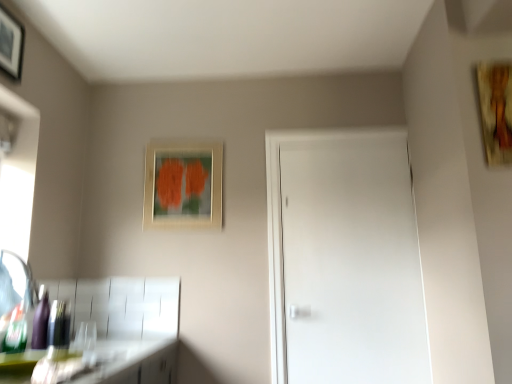
Locate an element on the screen. wooden textured painting at upper right, marked as the 3th picture frame in a back-to-front arrangement is located at coordinates (496, 111).

In order to click on matte wooden picture frame at upper center, which appears as the second picture frame when viewed from the right in this screenshot , I will do tap(183, 185).

Measure the distance between shiny purple bottle at lower left and camera.

The depth of shiny purple bottle at lower left is 1.80 meters.

This screenshot has height=384, width=512. In order to click on white matte door at center in this screenshot , I will do `click(344, 259)`.

Considering the relative sizes of wooden textured painting at upper right, marked as the 3th picture frame in a back-to-front arrangement, and green matte countertop at lower left in the image provided, is wooden textured painting at upper right, marked as the 3th picture frame in a back-to-front arrangement, wider than green matte countertop at lower left?

No.

Is wooden textured painting at upper right, which appears as the third picture frame when viewed from the left, further to camera compared to green matte countertop at lower left?

Yes, wooden textured painting at upper right, which appears as the third picture frame when viewed from the left, is further from the viewer.

From the green matte countertop at lower left, count 1st picture frames backward and point to it. Please provide its 2D coordinates.

[(496, 111)]

Is there a large distance between wooden textured painting at upper right, arranged as the first picture frame when viewed from the right, and green matte countertop at lower left?

Absolutely, wooden textured painting at upper right, arranged as the first picture frame when viewed from the right, is distant from green matte countertop at lower left.

Can you confirm if white matte door at center is thinner than wooden textured painting at upper right, which appears as the third picture frame when viewed from the left?

In fact, white matte door at center might be wider than wooden textured painting at upper right, which appears as the third picture frame when viewed from the left.

Between white matte door at center and wooden textured painting at upper right, which appears as the third picture frame when viewed from the left, which one has more height?

white matte door at center is taller.

Which is more to the right, white matte door at center or wooden textured painting at upper right, marked as the 3th picture frame in a back-to-front arrangement?

From the viewer's perspective, wooden textured painting at upper right, marked as the 3th picture frame in a back-to-front arrangement, appears more on the right side.

Is green matte countertop at lower left taller or shorter than white matte door at center?

In the image, green matte countertop at lower left appears to be shorter than white matte door at center.

From a real-world perspective, which object rests below the other?

From a 3D spatial view, green matte countertop at lower left is below.

Looking at this image, from the image's perspective, between green matte countertop at lower left and white matte door at center, which one is located above?

white matte door at center is shown above in the image.

Would you say green matte countertop at lower left is outside white matte door at center?

Absolutely, green matte countertop at lower left is external to white matte door at center.

The image size is (512, 384). Find the location of `the 1st picture frame in front of the shiny purple bottle at lower left, starting your count from the anchor`. the 1st picture frame in front of the shiny purple bottle at lower left, starting your count from the anchor is located at coordinates pyautogui.click(x=11, y=44).

Considering the positions of objects shiny purple bottle at lower left and wooden picture frame at upper left, the 3th picture frame positioned from the right, in the image provided, who is in front, shiny purple bottle at lower left or wooden picture frame at upper left, the 3th picture frame positioned from the right,?

wooden picture frame at upper left, the 3th picture frame positioned from the right.

Would you say shiny purple bottle at lower left is outside wooden picture frame at upper left, placed as the first picture frame when sorted from left to right?

That's correct, shiny purple bottle at lower left is outside of wooden picture frame at upper left, placed as the first picture frame when sorted from left to right.

From the image's perspective, which is below, shiny purple bottle at lower left or wooden picture frame at upper left, the 2th picture frame from the front?

From the image's view, shiny purple bottle at lower left is below.

Considering the sizes of objects wooden picture frame at upper left, the 2th picture frame from the front, and shiny purple bottle at lower left in the image provided, who is shorter, wooden picture frame at upper left, the 2th picture frame from the front, or shiny purple bottle at lower left?

shiny purple bottle at lower left is shorter.

Is there a large distance between wooden picture frame at upper left, the 3th picture frame positioned from the right, and shiny purple bottle at lower left?

Indeed, wooden picture frame at upper left, the 3th picture frame positioned from the right, is not near shiny purple bottle at lower left.

Can you confirm if wooden picture frame at upper left, which appears as the second picture frame when viewed from the back, is smaller than shiny purple bottle at lower left?

Actually, wooden picture frame at upper left, which appears as the second picture frame when viewed from the back, might be larger than shiny purple bottle at lower left.

Considering the points (21, 52) and (48, 297), which point is in front, point (21, 52) or point (48, 297)?

Positioned in front is point (21, 52).

From a real-world perspective, is green matte countertop at lower left above or below brushed metal faucet at lower left?

green matte countertop at lower left is situated lower than brushed metal faucet at lower left in the real world.

Based on their positions, is green matte countertop at lower left located to the left or right of brushed metal faucet at lower left?

From the image, it's evident that green matte countertop at lower left is to the right of brushed metal faucet at lower left.

Which is closer to the camera, [167,345] or [15,254]?

The point [15,254] is closer to the camera.

Is green matte countertop at lower left facing towards brushed metal faucet at lower left?

No, green matte countertop at lower left is not aimed at brushed metal faucet at lower left.

The image size is (512, 384). I want to click on the 1st picture frame positioned above the shiny purple bottle at lower left (from a real-world perspective), so click(183, 185).

Does matte wooden picture frame at upper center, which appears as the second picture frame when viewed from the right, have a larger size compared to shiny purple bottle at lower left?

Yes.

Considering the relative positions of matte wooden picture frame at upper center, which ranks as the 2th picture frame in left-to-right order, and shiny purple bottle at lower left in the image provided, is matte wooden picture frame at upper center, which ranks as the 2th picture frame in left-to-right order, to the left of shiny purple bottle at lower left from the viewer's perspective?

No.

In the scene shown: Which of these two, matte wooden picture frame at upper center, arranged as the 3th picture frame when viewed from the front, or shiny purple bottle at lower left, is thinner?

matte wooden picture frame at upper center, arranged as the 3th picture frame when viewed from the front, is thinner.

Where is `counter top lying in front of the wooden textured painting at upper right, arranged as the first picture frame when viewed from the right`? This screenshot has width=512, height=384. counter top lying in front of the wooden textured painting at upper right, arranged as the first picture frame when viewed from the right is located at coordinates (132, 363).

What are the coordinates of `the 2nd picture frame positioned above the white matte door at center (from the image's perspective)` in the screenshot? It's located at (496, 111).

From the image, which object appears to be farther from wooden picture frame at upper left, which appears as the second picture frame when viewed from the back, white matte door at center or green matte countertop at lower left?

Among the two, white matte door at center is located further to wooden picture frame at upper left, which appears as the second picture frame when viewed from the back.

When comparing their distances from shiny purple bottle at lower left, does wooden textured painting at upper right, arranged as the first picture frame when viewed from the right, or brushed metal faucet at lower left seem further?

wooden textured painting at upper right, arranged as the first picture frame when viewed from the right, lies further to shiny purple bottle at lower left than the other object.

From the image, which object appears to be nearer to white matte door at center, wooden textured painting at upper right, arranged as the first picture frame when viewed from the right, or shiny purple bottle at lower left?

The object closer to white matte door at center is wooden textured painting at upper right, arranged as the first picture frame when viewed from the right.

Based on their spatial positions, is matte wooden picture frame at upper center, placed as the 1th picture frame when sorted from back to front, or white matte door at center closer to wooden picture frame at upper left, the 2th picture frame from the front?

matte wooden picture frame at upper center, placed as the 1th picture frame when sorted from back to front, is positioned closer to the anchor wooden picture frame at upper left, the 2th picture frame from the front.

When comparing their distances from matte wooden picture frame at upper center, which ranks as the 2th picture frame in left-to-right order, does wooden picture frame at upper left, placed as the first picture frame when sorted from left to right, or green matte countertop at lower left seem further?

wooden picture frame at upper left, placed as the first picture frame when sorted from left to right, is positioned further to the anchor matte wooden picture frame at upper center, which ranks as the 2th picture frame in left-to-right order.

Estimate the real-world distances between objects in this image. Which object is closer to matte wooden picture frame at upper center, which appears as the second picture frame when viewed from the right, white matte door at center or green matte countertop at lower left?

white matte door at center is positioned closer to the anchor matte wooden picture frame at upper center, which appears as the second picture frame when viewed from the right.

Consider the image. Which object lies nearer to the anchor point green matte countertop at lower left, matte wooden picture frame at upper center, which appears as the second picture frame when viewed from the right, or wooden picture frame at upper left, placed as the first picture frame when sorted from left to right?

matte wooden picture frame at upper center, which appears as the second picture frame when viewed from the right.

Which object lies nearer to the anchor point brushed metal faucet at lower left, wooden textured painting at upper right, which appears as the third picture frame when viewed from the left, or white matte door at center?

white matte door at center lies closer to brushed metal faucet at lower left than the other object.

The image size is (512, 384). Find the location of `bottle between brushed metal faucet at lower left and matte wooden picture frame at upper center, which appears as the second picture frame when viewed from the right, along the z-axis`. bottle between brushed metal faucet at lower left and matte wooden picture frame at upper center, which appears as the second picture frame when viewed from the right, along the z-axis is located at coordinates (41, 320).

Where is `picture frame between shiny purple bottle at lower left and wooden textured painting at upper right, which appears as the third picture frame when viewed from the left, in the horizontal direction`? picture frame between shiny purple bottle at lower left and wooden textured painting at upper right, which appears as the third picture frame when viewed from the left, in the horizontal direction is located at coordinates (183, 185).

In order to click on counter top between brushed metal faucet at lower left and white matte door at center from left to right in this screenshot , I will do `click(132, 363)`.

Identify the location of counter top between wooden picture frame at upper left, placed as the first picture frame when sorted from left to right, and wooden textured painting at upper right, marked as the 3th picture frame in a back-to-front arrangement, in the horizontal direction. (132, 363).